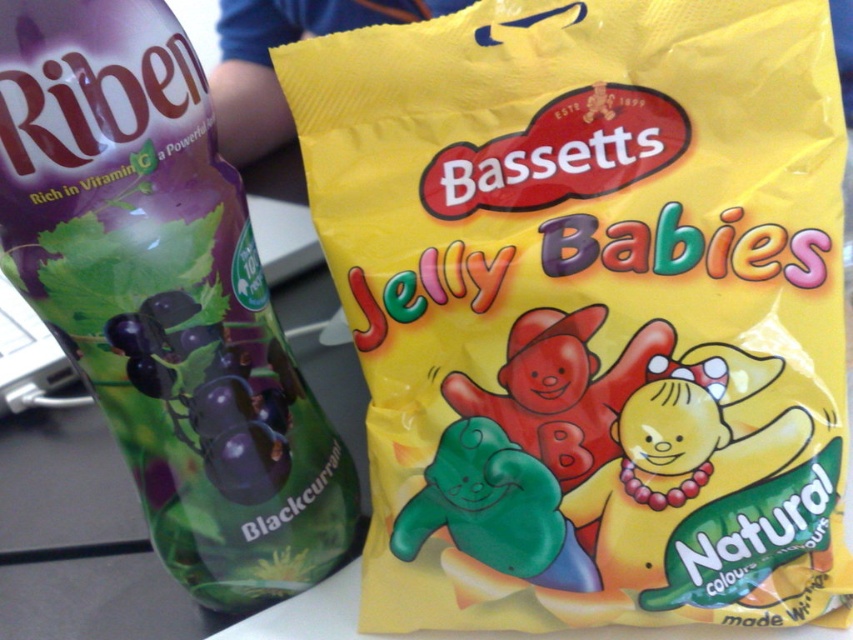
Who is lower down, translucent purple bottle at left or green rubber bear at center?

green rubber bear at center is lower down.

The image size is (853, 640). Describe the element at coordinates (164, 298) in the screenshot. I see `translucent purple bottle at left` at that location.

Is point (201, 442) positioned before point (514, 474)?

That is False.

Where is `translucent purple bottle at left`? The height and width of the screenshot is (640, 853). translucent purple bottle at left is located at coordinates (164, 298).

Is yellow matte plastic bag of jelly babies at right to the left of translucent purple bottle at left from the viewer's perspective?

No, yellow matte plastic bag of jelly babies at right is not to the left of translucent purple bottle at left.

What do you see at coordinates (589, 307) in the screenshot? I see `yellow matte plastic bag of jelly babies at right` at bounding box center [589, 307].

What are the coordinates of `yellow matte plastic bag of jelly babies at right` in the screenshot? It's located at (589, 307).

Is yellow matte plastic bag of jelly babies at right behind green rubber bear at center?

No, yellow matte plastic bag of jelly babies at right is in front of green rubber bear at center.

Is point (711, 32) behind point (529, 541)?

No.

Where is `yellow matte plastic bag of jelly babies at right`? yellow matte plastic bag of jelly babies at right is located at coordinates (589, 307).